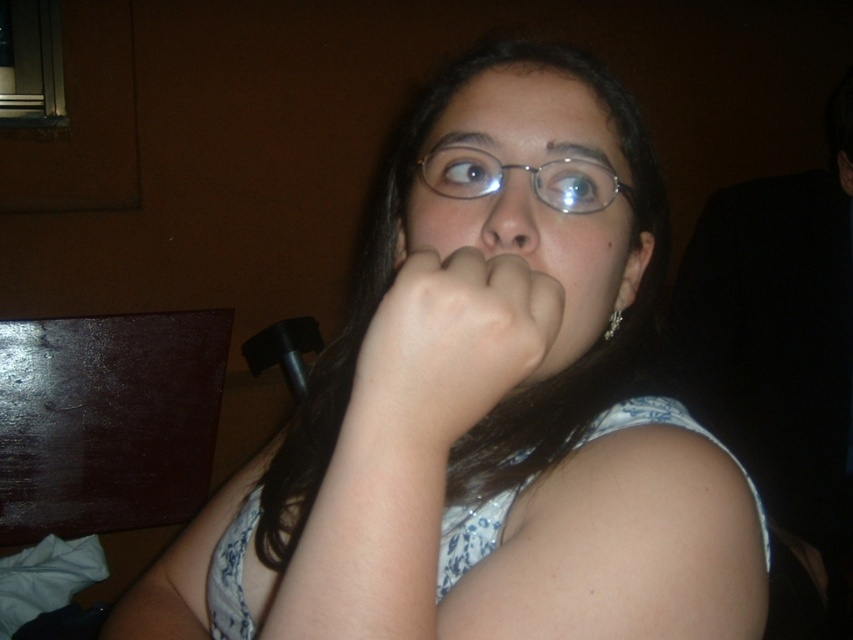
Can you confirm if matte glass face at center is shorter than pale skin/flesh tone hand at center?

No, matte glass face at center is not shorter than pale skin/flesh tone hand at center.

Which is more to the right, matte glass face at center or pale skin/flesh tone hand at center?

matte glass face at center is more to the right.

Who is more distant from viewer, [454,154] or [453,436]?

Point [454,154]

At what (x,y) coordinates should I click in order to perform the action: click on matte glass face at center. Please return your answer as a coordinate pair (x, y). Looking at the image, I should click on tap(519, 227).

Is point (553, 276) more distant than point (573, 193)?

No, (553, 276) is closer to viewer.

This screenshot has height=640, width=853. What do you see at coordinates (519, 227) in the screenshot?
I see `matte glass face at center` at bounding box center [519, 227].

Which is in front, point (584, 170) or point (492, 163)?

Point (492, 163) is more forward.

I want to click on matte glass face at center, so click(519, 227).

Which of these two, white floral dress at center or matte glass nose at center, stands shorter?

With less height is matte glass nose at center.

Between point (569, 451) and point (514, 243), which one is positioned behind?

The point (569, 451) is behind.

This screenshot has width=853, height=640. I want to click on white floral dress at center, so click(482, 422).